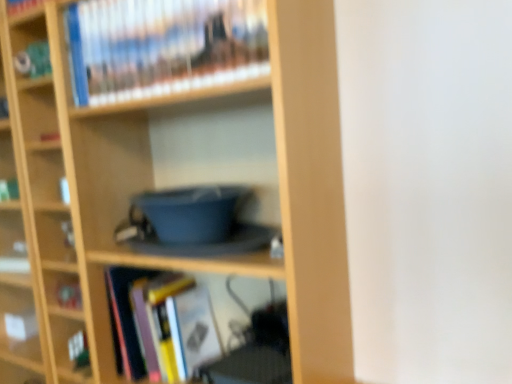
You are a GUI agent. You are given a task and a screenshot of the screen. Output one action in this format:
    pyautogui.click(x=<x>, y=<y>)
    Task: Click on the hardcover book at lower left, which is counted as the 2th book, starting from the top
    This screenshot has width=512, height=384.
    Given the screenshot: What is the action you would take?
    pyautogui.click(x=68, y=294)

Consider the image. Is hardcover book at center, acting as the third book starting from the top, at the back of hardcover book at upper center, which is counted as the 1th book, starting from the top?

No, hardcover book at center, acting as the third book starting from the top, is not at the back of hardcover book at upper center, which is counted as the 1th book, starting from the top.

From the image's perspective, which object appears higher, hardcover book at upper center, marked as the third book in a bottom-to-top arrangement, or hardcover book at center, which is counted as the first book, starting from the bottom?

hardcover book at upper center, marked as the third book in a bottom-to-top arrangement, appears higher in the image.

How much distance is there between hardcover book at upper center, marked as the third book in a bottom-to-top arrangement, and hardcover book at center, which is counted as the first book, starting from the bottom?

23.22 inches.

Which of these two, hardcover book at upper center, marked as the third book in a bottom-to-top arrangement, or hardcover book at center, which is counted as the first book, starting from the bottom, is smaller?

Smaller between the two is hardcover book at upper center, marked as the third book in a bottom-to-top arrangement.

Who is more distant, wooden bookcase at center or hardcover book at lower left, which is counted as the 2th book, starting from the top?

Positioned behind is hardcover book at lower left, which is counted as the 2th book, starting from the top.

Who is bigger, wooden bookcase at center or hardcover book at lower left, which ranks as the 2th book in bottom-to-top order?

With larger size is wooden bookcase at center.

From a real-world perspective, is wooden bookcase at center located beneath hardcover book at lower left, which is counted as the 2th book, starting from the top?

No, from a real-world perspective, wooden bookcase at center is not beneath hardcover book at lower left, which is counted as the 2th book, starting from the top.

What are the coordinates of `book that is the 1st one when counting downward from the wooden bookcase at center (from the image's perspective)` in the screenshot? It's located at (68, 294).

Is hardcover book at center, which is counted as the first book, starting from the bottom, far away from hardcover book at lower left, which ranks as the 2th book in bottom-to-top order?

They are positioned close to each other.

Can hardcover book at lower left, which ranks as the 2th book in bottom-to-top order, be found inside hardcover book at center, acting as the third book starting from the top?

Actually, hardcover book at lower left, which ranks as the 2th book in bottom-to-top order, is outside hardcover book at center, acting as the third book starting from the top.

Consider the image. Which of these two, hardcover book at center, which is counted as the first book, starting from the bottom, or hardcover book at lower left, which is counted as the 2th book, starting from the top, is wider?

Wider between the two is hardcover book at center, which is counted as the first book, starting from the bottom.

Looking at this image, from the image's perspective, which is above, hardcover book at center, which is counted as the first book, starting from the bottom, or hardcover book at lower left, which ranks as the 2th book in bottom-to-top order?

hardcover book at lower left, which ranks as the 2th book in bottom-to-top order, is shown above in the image.

Based on the photo, how distant is wooden bookcase at center from hardcover book at upper center, which is counted as the 1th book, starting from the top?

22.55 centimeters.

Between wooden bookcase at center and hardcover book at upper center, marked as the third book in a bottom-to-top arrangement, which one is positioned in front?

wooden bookcase at center is more forward.

Starting from the wooden bookcase at center, which book is the 1st one behind? Please provide its 2D coordinates.

[(164, 46)]

Can you confirm if wooden bookcase at center is bigger than hardcover book at upper center, which is counted as the 1th book, starting from the top?

Indeed, wooden bookcase at center has a larger size compared to hardcover book at upper center, which is counted as the 1th book, starting from the top.

Is hardcover book at center, which is counted as the first book, starting from the bottom, with wooden bookcase at center?

No.

Considering the relative sizes of hardcover book at center, acting as the third book starting from the top, and wooden bookcase at center in the image provided, is hardcover book at center, acting as the third book starting from the top, thinner than wooden bookcase at center?

Correct, the width of hardcover book at center, acting as the third book starting from the top, is less than that of wooden bookcase at center.

Is hardcover book at center, acting as the third book starting from the top, completely or partially outside of wooden bookcase at center?

No, hardcover book at center, acting as the third book starting from the top, is inside wooden bookcase at center's boundary.

Can you tell me how much hardcover book at center, acting as the third book starting from the top, and wooden bookcase at center differ in facing direction?

0.553 degrees separate the facing orientations of hardcover book at center, acting as the third book starting from the top, and wooden bookcase at center.

Which of these two, hardcover book at center, which is counted as the first book, starting from the bottom, or hardcover book at upper center, which is counted as the 1th book, starting from the top, is thinner?

With smaller width is hardcover book at upper center, which is counted as the 1th book, starting from the top.

Looking at the image, does hardcover book at center, acting as the third book starting from the top, seem bigger or smaller compared to hardcover book at upper center, marked as the third book in a bottom-to-top arrangement?

Clearly, hardcover book at center, acting as the third book starting from the top, is larger in size than hardcover book at upper center, marked as the third book in a bottom-to-top arrangement.

Visually, is hardcover book at center, which is counted as the first book, starting from the bottom, positioned to the left or to the right of hardcover book at upper center, which is counted as the 1th book, starting from the top?

hardcover book at center, which is counted as the first book, starting from the bottom, is positioned on hardcover book at upper center, which is counted as the 1th book, starting from the top,'s right side.

Which object is closer to the camera taking this photo, hardcover book at lower left, which ranks as the 2th book in bottom-to-top order, or wooden bookcase at center?

Positioned in front is wooden bookcase at center.

Is hardcover book at lower left, which ranks as the 2th book in bottom-to-top order, taller or shorter than wooden bookcase at center?

hardcover book at lower left, which ranks as the 2th book in bottom-to-top order, is shorter than wooden bookcase at center.

Which object is thinner, hardcover book at lower left, which is counted as the 2th book, starting from the top, or wooden bookcase at center?

hardcover book at lower left, which is counted as the 2th book, starting from the top.

Find the location of a particular element. Image resolution: width=512 pixels, height=384 pixels. book that is the 2nd object located below the hardcover book at upper center, which is counted as the 1th book, starting from the top (from the image's perspective) is located at coordinates (162, 323).

Where is `bookcase that appears in front of the hardcover book at lower left, which ranks as the 2th book in bottom-to-top order`? bookcase that appears in front of the hardcover book at lower left, which ranks as the 2th book in bottom-to-top order is located at coordinates (152, 185).

Based on their spatial positions, is hardcover book at lower left, which is counted as the 2th book, starting from the top, or hardcover book at upper center, marked as the third book in a bottom-to-top arrangement, closer to hardcover book at center, acting as the third book starting from the top?

Based on the image, hardcover book at lower left, which is counted as the 2th book, starting from the top, appears to be nearer to hardcover book at center, acting as the third book starting from the top.

From the image, which object appears to be nearer to wooden bookcase at center, hardcover book at lower left, which ranks as the 2th book in bottom-to-top order, or hardcover book at center, acting as the third book starting from the top?

Based on the image, hardcover book at center, acting as the third book starting from the top, appears to be nearer to wooden bookcase at center.

Looking at the image, which one is located closer to wooden bookcase at center, hardcover book at upper center, marked as the third book in a bottom-to-top arrangement, or hardcover book at center, acting as the third book starting from the top?

hardcover book at upper center, marked as the third book in a bottom-to-top arrangement, is positioned closer to the anchor wooden bookcase at center.

Estimate the real-world distances between objects in this image. Which object is further from hardcover book at upper center, which is counted as the 1th book, starting from the top, wooden bookcase at center or hardcover book at lower left, which ranks as the 2th book in bottom-to-top order?

hardcover book at lower left, which ranks as the 2th book in bottom-to-top order.

From the picture: From the image, which object appears to be farther from hardcover book at lower left, which is counted as the 2th book, starting from the top, hardcover book at center, which is counted as the first book, starting from the bottom, or hardcover book at upper center, which is counted as the 1th book, starting from the top?

hardcover book at upper center, which is counted as the 1th book, starting from the top, is positioned further to the anchor hardcover book at lower left, which is counted as the 2th book, starting from the top.

From the image, which object appears to be nearer to hardcover book at upper center, which is counted as the 1th book, starting from the top, hardcover book at center, acting as the third book starting from the top, or wooden bookcase at center?

Based on the image, wooden bookcase at center appears to be nearer to hardcover book at upper center, which is counted as the 1th book, starting from the top.

In the scene shown: Looking at the image, which one is located closer to hardcover book at lower left, which is counted as the 2th book, starting from the top, wooden bookcase at center or hardcover book at upper center, which is counted as the 1th book, starting from the top?

The object closer to hardcover book at lower left, which is counted as the 2th book, starting from the top, is wooden bookcase at center.

When comparing their distances from hardcover book at upper center, which is counted as the 1th book, starting from the top, does wooden bookcase at center or hardcover book at center, acting as the third book starting from the top, seem further?

Among the two, hardcover book at center, acting as the third book starting from the top, is located further to hardcover book at upper center, which is counted as the 1th book, starting from the top.

The height and width of the screenshot is (384, 512). What are the coordinates of `book that lies between hardcover book at upper center, which is counted as the 1th book, starting from the top, and hardcover book at center, acting as the third book starting from the top, from top to bottom` in the screenshot? It's located at (68, 294).

Identify the location of bookcase between hardcover book at upper center, which is counted as the 1th book, starting from the top, and hardcover book at center, acting as the third book starting from the top, vertically. (152, 185).